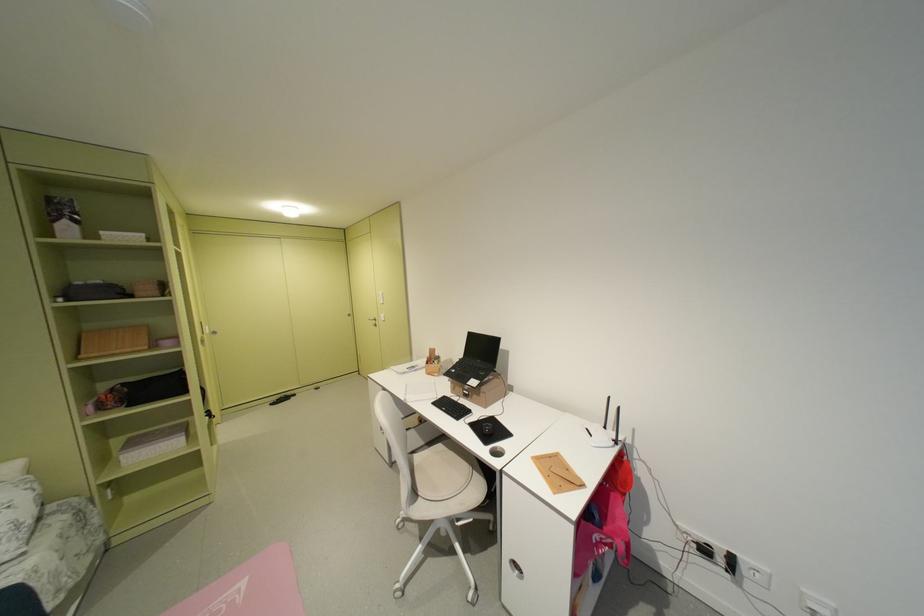
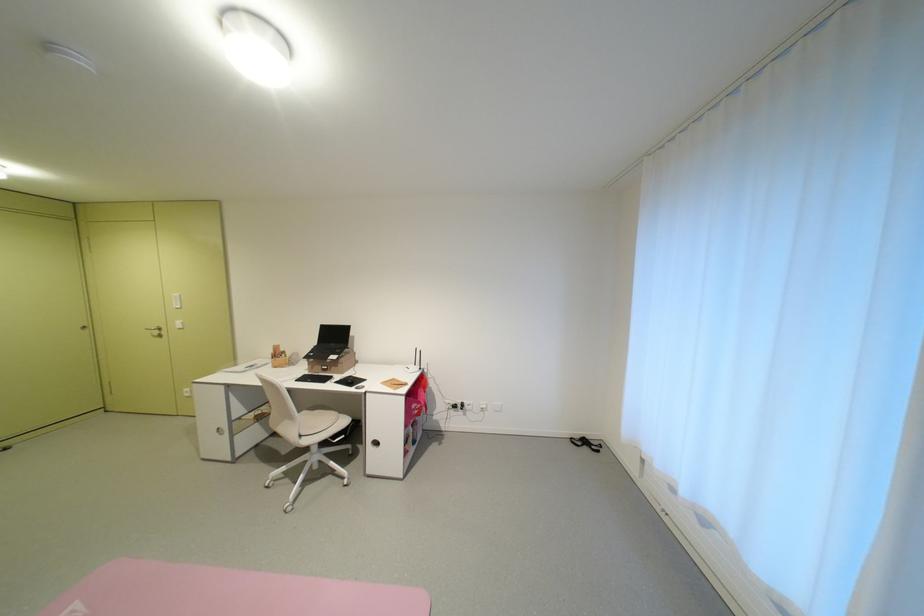
Locate, in the second image, the point that corresponds to point (379, 321) in the first image.

(156, 331)